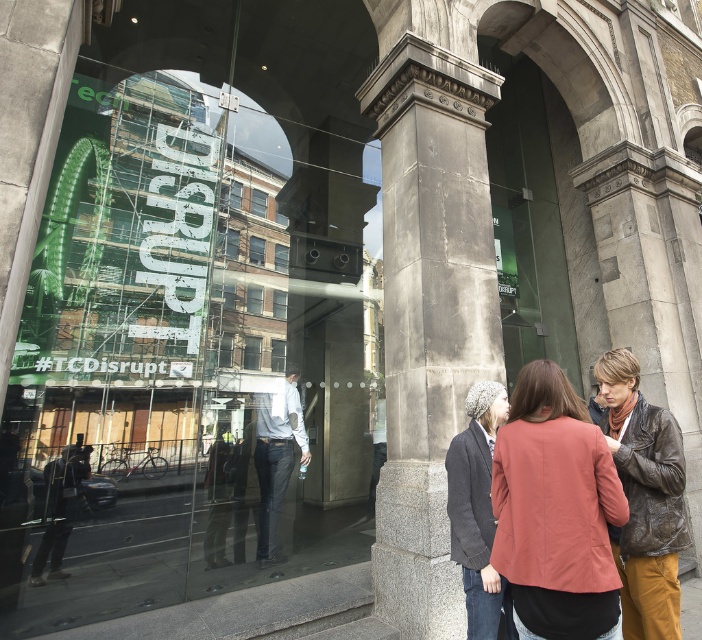
You are a delivery person trying to locate the entrance to the building. The gray stone column at center is marked on your map at coordinates point 0.491, 0.613. If the entrance is directly in front of the column, where should you head?

The entrance is directly in front of the gray stone column at center, which is located at point (430, 314). Therefore, you should head towards that coordinate to find the entrance.

You are standing outside the modern building and want to take a photo of the gray stone column at center and the leather jacket at center. Which object should you focus on first to ensure both are in the frame?

You should focus on the gray stone column at center first because it is closer to you than the leather jacket at center, ensuring both are in the frame.